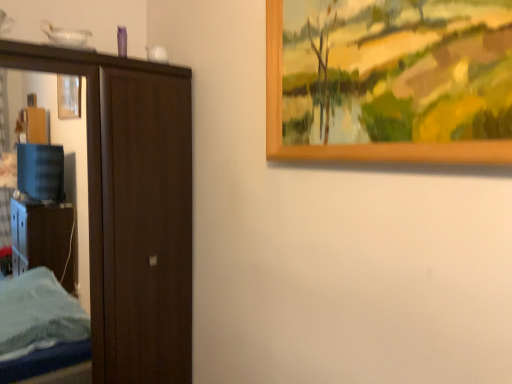
Question: Is dark wood door at left facing towards wooden picture frame at upper right?

Choices:
 (A) no
 (B) yes

Answer: (B)

Question: Can you confirm if dark wood door at left is bigger than wooden picture frame at upper right?

Choices:
 (A) no
 (B) yes

Answer: (B)

Question: Is dark wood door at left shorter than wooden picture frame at upper right?

Choices:
 (A) no
 (B) yes

Answer: (A)

Question: Does dark wood door at left contain wooden picture frame at upper right?

Choices:
 (A) yes
 (B) no

Answer: (B)

Question: Is the depth of dark wood door at left less than that of wooden picture frame at upper right?

Choices:
 (A) yes
 (B) no

Answer: (B)

Question: Is dark wood door at left to the left of wooden picture frame at upper right from the viewer's perspective?

Choices:
 (A) no
 (B) yes

Answer: (B)

Question: Is wooden picture frame at upper right turned away from dark wood door at left?

Choices:
 (A) no
 (B) yes

Answer: (A)

Question: From a real-world perspective, is wooden picture frame at upper right on top of dark wood door at left?

Choices:
 (A) no
 (B) yes

Answer: (B)

Question: Does wooden picture frame at upper right lie behind dark wood door at left?

Choices:
 (A) no
 (B) yes

Answer: (A)

Question: From the image's perspective, is wooden picture frame at upper right on top of dark wood door at left?

Choices:
 (A) yes
 (B) no

Answer: (A)

Question: Can you confirm if wooden picture frame at upper right is shorter than dark wood door at left?

Choices:
 (A) yes
 (B) no

Answer: (A)

Question: Is wooden picture frame at upper right aimed at dark wood door at left?

Choices:
 (A) yes
 (B) no

Answer: (B)

Question: From the image's perspective, is wooden picture frame at upper right located above or below dark wood door at left?

Choices:
 (A) below
 (B) above

Answer: (B)